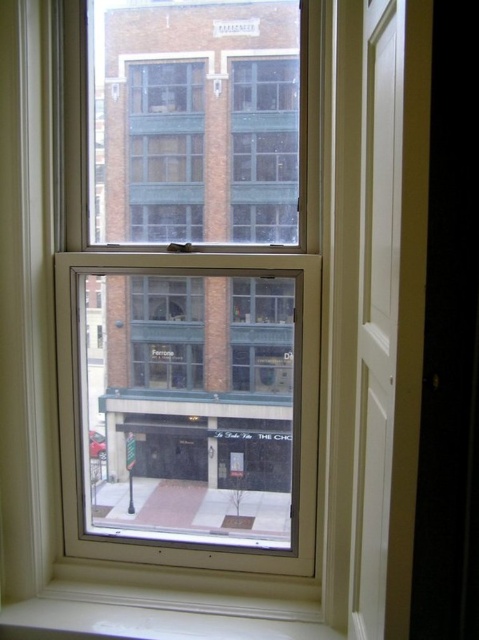
Question: Which point appears closest to the camera in this image?

Choices:
 (A) (308, 620)
 (B) (81, 99)

Answer: (A)

Question: Is clear glass window at center above white smooth window sill at lower center?

Choices:
 (A) no
 (B) yes

Answer: (B)

Question: Is the position of clear glass window at center less distant than that of white smooth window sill at lower center?

Choices:
 (A) yes
 (B) no

Answer: (B)

Question: Among these objects, which one is nearest to the camera?

Choices:
 (A) white smooth window sill at lower center
 (B) clear glass window at center

Answer: (A)

Question: Does clear glass window at center appear on the left side of white smooth window sill at lower center?

Choices:
 (A) yes
 (B) no

Answer: (B)